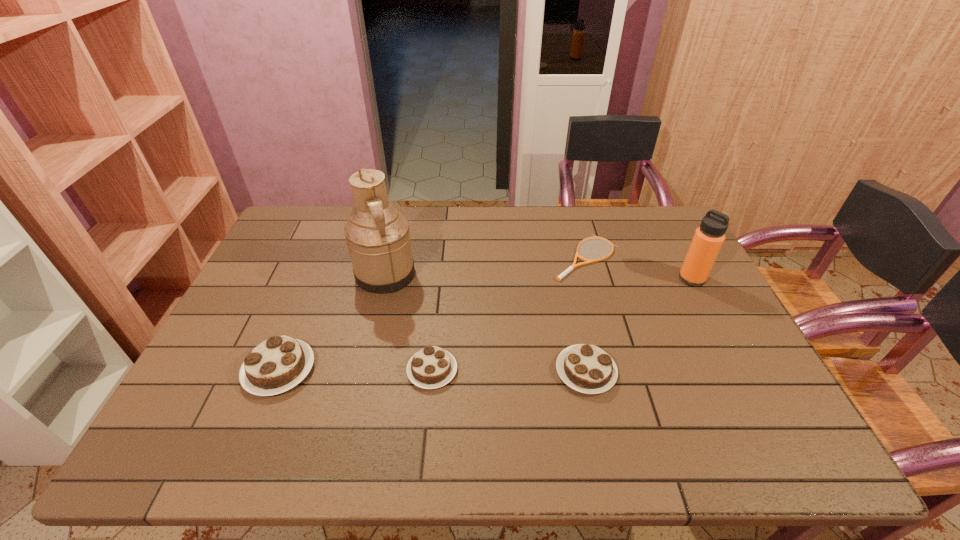
Where is `the leftmost chocolate cake`? The height and width of the screenshot is (540, 960). the leftmost chocolate cake is located at coordinates (279, 363).

Where is `the shortest chocolate cake`? the shortest chocolate cake is located at coordinates (432, 367).

Find the location of a particular element. the fourth object from right to left is located at coordinates (432, 367).

At what (x,y) coordinates should I click in order to perform the action: click on the rightmost chocolate cake. Please return your answer as a coordinate pair (x, y). The width and height of the screenshot is (960, 540). Looking at the image, I should click on (586, 368).

At what (x,y) coordinates should I click in order to perform the action: click on the fourth tallest object. Please return your answer as a coordinate pair (x, y). The image size is (960, 540). Looking at the image, I should click on (586, 368).

At what (x,y) coordinates should I click in order to perform the action: click on the second object from left to right. Please return your answer as a coordinate pair (x, y). This screenshot has width=960, height=540. Looking at the image, I should click on click(x=378, y=238).

At what (x,y) coordinates should I click in order to perform the action: click on the tallest object. Please return your answer as a coordinate pair (x, y). The image size is (960, 540). Looking at the image, I should click on (x=378, y=238).

The image size is (960, 540). I want to click on the shortest object, so click(574, 265).

You are a GUI agent. You are given a task and a screenshot of the screen. Output one action in this format:
    pyautogui.click(x=<x>, y=<y>)
    Task: Click on the fifth shortest object
    The height and width of the screenshot is (540, 960).
    Given the screenshot: What is the action you would take?
    pyautogui.click(x=708, y=239)

I want to click on the rightmost object, so click(x=708, y=239).